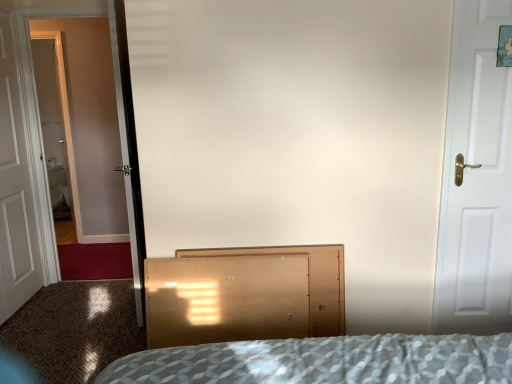
Question: Would you say light brown wood dresser at center is to the left or to the right of white wooden door at left, which is the second door from right to left, in the picture?

Choices:
 (A) left
 (B) right

Answer: (B)

Question: Looking at their shapes, would you say light brown wood dresser at center is wider or thinner than white wooden door at left, which appears as the first door when viewed from the left?

Choices:
 (A) wide
 (B) thin

Answer: (A)

Question: Considering the real-world distances, which object is farthest from the light brown wood dresser at center?

Choices:
 (A) clear glass screen door at left
 (B) white matte door at right, the 1th door viewed from the front
 (C) white wooden door at left, which is the second door from right to left

Answer: (C)

Question: Which object is positioned farthest from the white wooden door at left, which appears as the first door when viewed from the left?

Choices:
 (A) clear glass screen door at left
 (B) white matte door at right, arranged as the second door when viewed from the back
 (C) light brown wood dresser at center

Answer: (B)